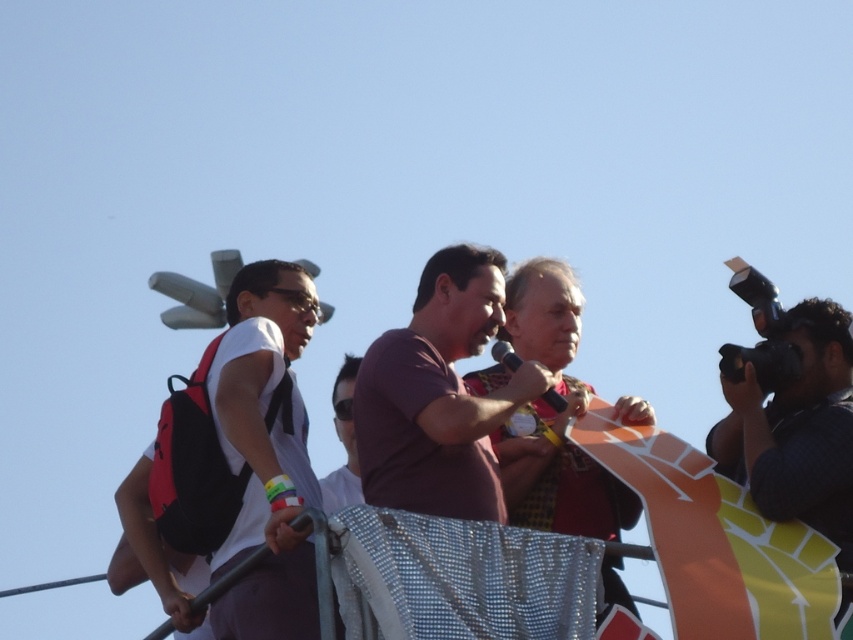
Question: Does white matte shirt at left appear on the left side of black textured camera at right?

Choices:
 (A) no
 (B) yes

Answer: (B)

Question: Can you confirm if white matte shirt at left is positioned above purple matte shirt at center?

Choices:
 (A) no
 (B) yes

Answer: (A)

Question: Which point is closer to the camera?

Choices:
 (A) white matte shirt at left
 (B) purple matte shirt at center
 (C) black textured camera at right

Answer: (A)

Question: Does white matte shirt at left appear over purple matte shirt at center?

Choices:
 (A) no
 (B) yes

Answer: (A)

Question: Among these points, which one is farthest from the camera?

Choices:
 (A) (804, 486)
 (B) (387, 365)
 (C) (303, 424)

Answer: (C)

Question: Which point is farther to the camera?

Choices:
 (A) (x=373, y=464)
 (B) (x=247, y=625)
 (C) (x=834, y=497)

Answer: (C)